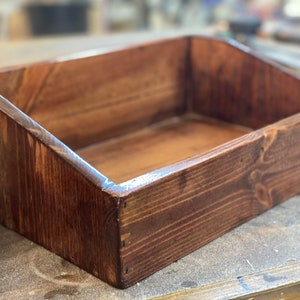
Where is `front of wooden box`? front of wooden box is located at coordinates pyautogui.click(x=193, y=210).